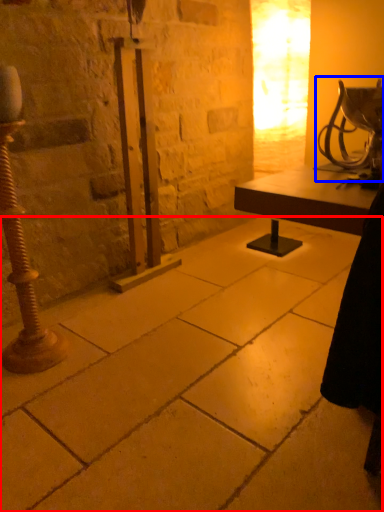
Question: Among these objects, which one is farthest to the camera, concrete (highlighted by a red box) or table lamp (highlighted by a blue box)?

Choices:
 (A) concrete
 (B) table lamp

Answer: (B)